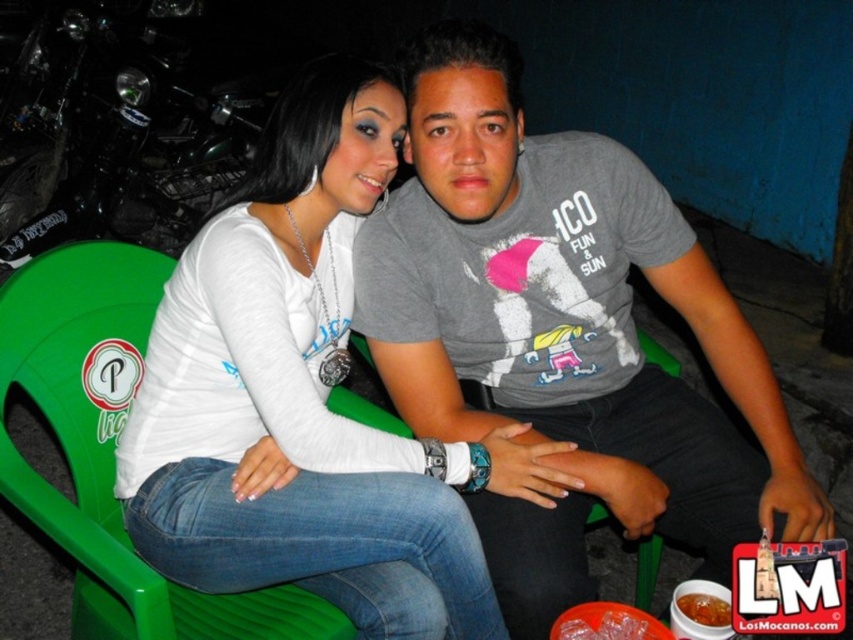
You are designing a poster for a local event and need to ensure that the white matte shirt at center and the green plastic chair at center are clearly visible. Given their sizes, which object should be placed closer to the front of the poster to maintain visibility?

The white matte shirt at center has a larger size compared to the green plastic chair at center, so placing it closer to the front of the poster will ensure it remains clearly visible.